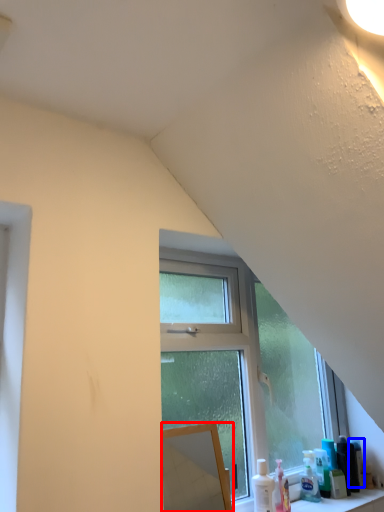
Question: Which object appears closest to the camera in this image, mirror (highlighted by a red box) or toiletry (highlighted by a blue box)?

Choices:
 (A) mirror
 (B) toiletry

Answer: (A)